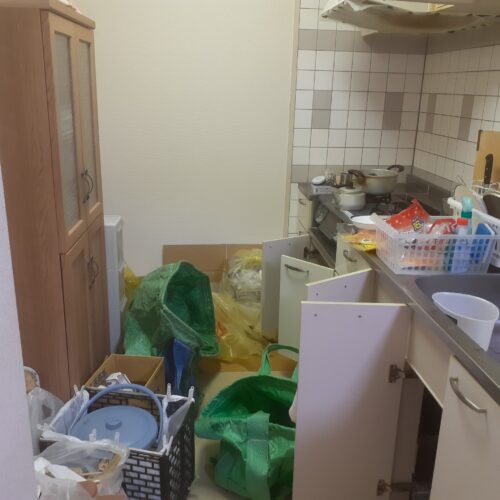
Identify the location of basket. (136, 455), (397, 252).